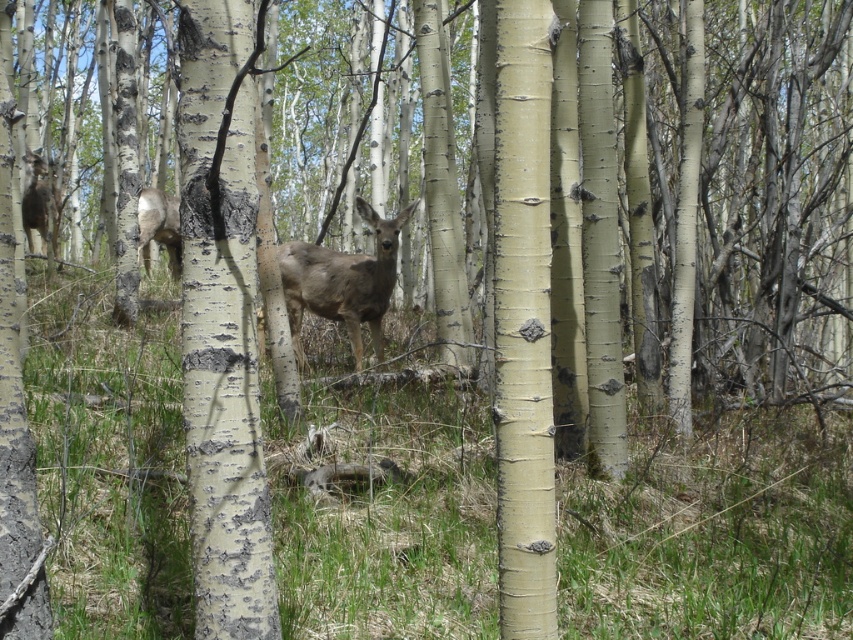
At what (x,y) coordinates should I click in order to perform the action: click on brown fur deer at center. Please return your answer as a coordinate pair (x, y). This screenshot has height=640, width=853. Looking at the image, I should click on (341, 282).

Who is more forward, [358,262] or [160,216]?

Positioned in front is point [358,262].

The height and width of the screenshot is (640, 853). What are the coordinates of `brown fur deer at center` in the screenshot? It's located at (341, 282).

Is point (173, 276) less distant than point (28, 250)?

Yes, it is in front of point (28, 250).

At what (x,y) coordinates should I click in order to perform the action: click on brown matte deer at center. Please return your answer as a coordinate pair (x, y). The height and width of the screenshot is (640, 853). Looking at the image, I should click on (160, 227).

Can you confirm if brown fur deer at center is bigger than brown fur deer at left?

Actually, brown fur deer at center might be smaller than brown fur deer at left.

Find the location of `brown fur deer at center`. brown fur deer at center is located at coordinates (341, 282).

Who is more distant from viewer, (300,273) or (51,189)?

The point (51,189) is behind.

You are a GUI agent. You are given a task and a screenshot of the screen. Output one action in this format:
    pyautogui.click(x=<x>, y=<y>)
    Task: Click on the brown fur deer at center
    
    Given the screenshot: What is the action you would take?
    pyautogui.click(x=341, y=282)